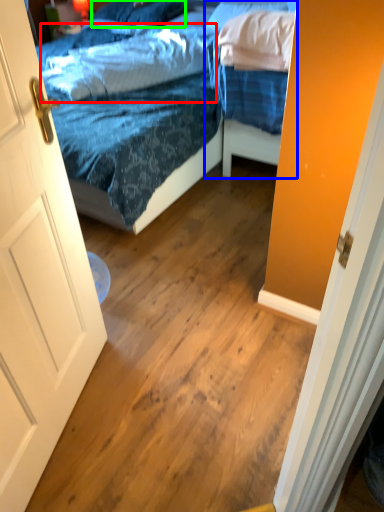
Question: Based on their relative distances, which object is farther from pillow (highlighted by a red box)? Choose from bed (highlighted by a blue box) and pillow (highlighted by a green box).

Choices:
 (A) bed
 (B) pillow

Answer: (B)